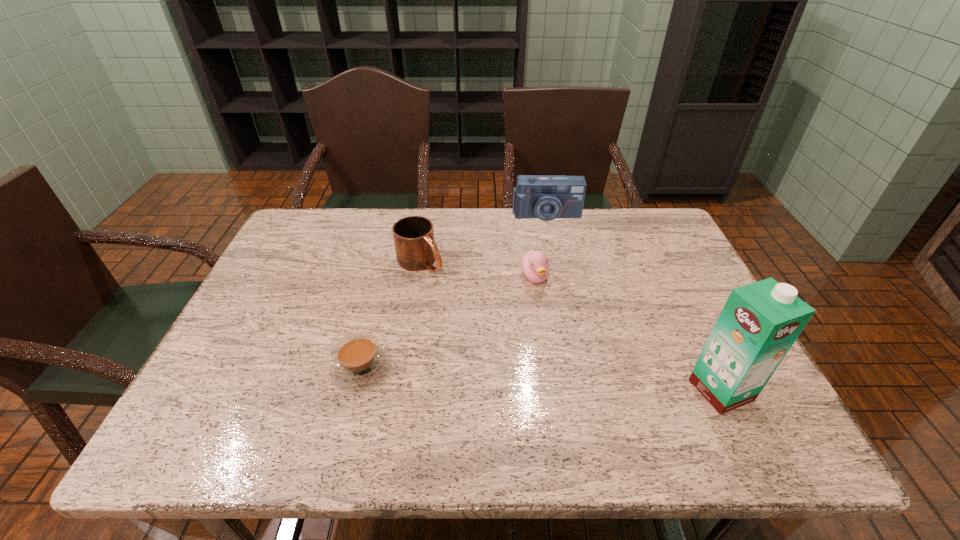
At what (x,y) coordinates should I click in order to perform the action: click on vacant area located 0.360m on the front-facing side of the duckling. Please return your answer as a coordinate pair (x, y). Looking at the image, I should click on (601, 407).

Identify the location of vacant space located on the front-facing side of the duckling. Image resolution: width=960 pixels, height=540 pixels. (547, 304).

I want to click on vacant space situated on the side of the mug with the handle, so click(496, 321).

Identify the location of free space located 0.260m on the side of the mug with the handle. (502, 326).

Find the location of `vacant region located on the side of the mug with the handle`. vacant region located on the side of the mug with the handle is located at coordinates (516, 337).

What are the coordinates of `free spot located on the lens of the camera` in the screenshot? It's located at (551, 247).

Where is `vacant space located on the lens of the camera`? The width and height of the screenshot is (960, 540). vacant space located on the lens of the camera is located at coordinates [561, 310].

The height and width of the screenshot is (540, 960). What are the coordinates of `vacant space located 0.090m on the lens of the camera` in the screenshot? It's located at (549, 239).

Locate an element on the screen. The height and width of the screenshot is (540, 960). mug present at the far edge is located at coordinates [415, 247].

I want to click on camera positioned at the far edge, so click(x=546, y=197).